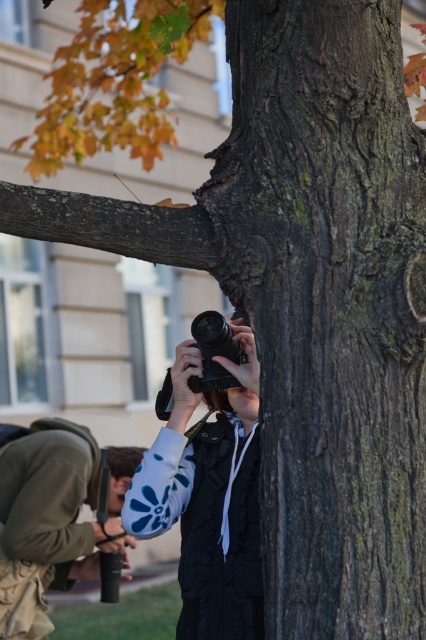
Question: Is black matte camera at center positioned in front of denim jacket at lower left?

Choices:
 (A) no
 (B) yes

Answer: (B)

Question: Is black matte camera at center wider than denim jacket at lower left?

Choices:
 (A) no
 (B) yes

Answer: (A)

Question: Which point is closer to the camera?

Choices:
 (A) (111, 499)
 (B) (193, 362)

Answer: (B)

Question: Is black matte camera at center to the right of denim jacket at lower left from the viewer's perspective?

Choices:
 (A) no
 (B) yes

Answer: (B)

Question: Which point is closer to the camera taking this photo?

Choices:
 (A) (152, 506)
 (B) (43, 509)

Answer: (A)